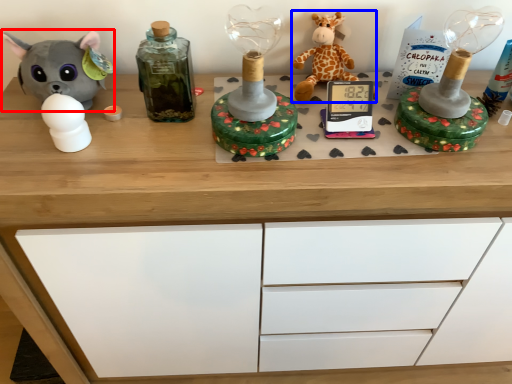
Question: Among these objects, which one is nearest to the camera, toy (highlighted by a red box) or toy (highlighted by a blue box)?

Choices:
 (A) toy
 (B) toy

Answer: (A)